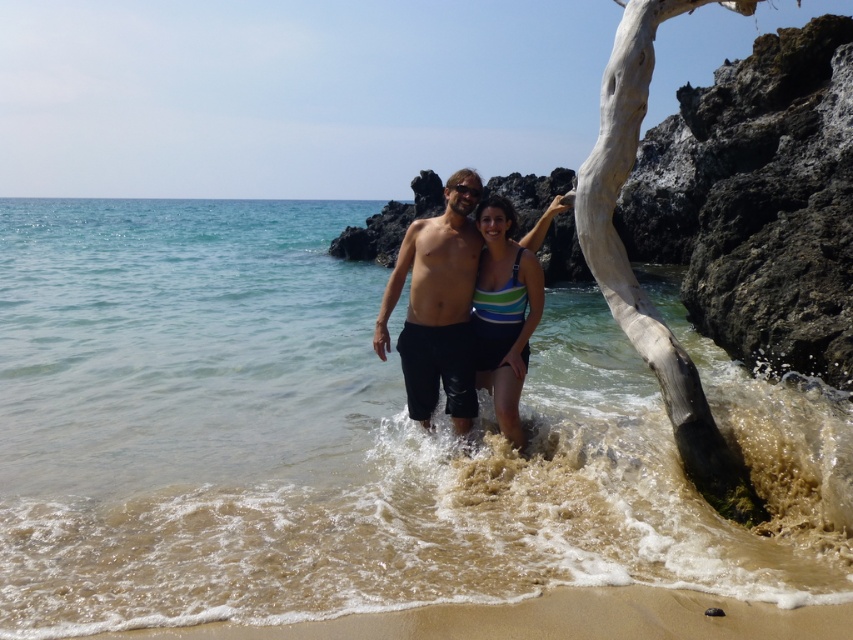
Question: Is matte black shorts at center above striped fabric swimsuit at center?

Choices:
 (A) no
 (B) yes

Answer: (B)

Question: Does matte black shorts at center come in front of white textured driftwood at center?

Choices:
 (A) yes
 (B) no

Answer: (B)

Question: Which is farther from the white textured driftwood at center?

Choices:
 (A) matte black shorts at center
 (B) striped fabric swimsuit at center

Answer: (A)

Question: Is clear water at center wider than matte black shorts at center?

Choices:
 (A) no
 (B) yes

Answer: (B)

Question: Which of these objects is positioned closest to the matte black shorts at center?

Choices:
 (A) striped fabric swimsuit at center
 (B) white textured driftwood at center

Answer: (A)

Question: Among these points, which one is nearest to the camera?

Choices:
 (A) (488, 280)
 (B) (627, 301)
 (C) (728, 424)
 (D) (525, 276)

Answer: (C)